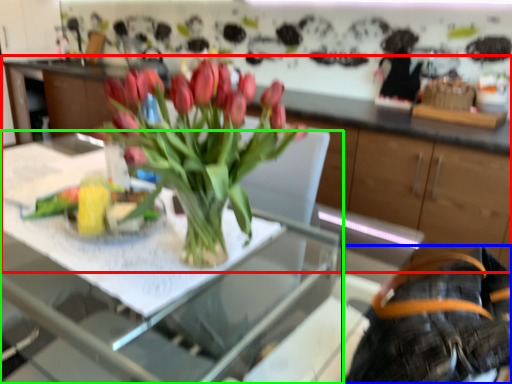
Question: Which object is positioned closest to cabinetry (highlighted by a red box)? Select from back (highlighted by a blue box) and table (highlighted by a green box).

Choices:
 (A) back
 (B) table

Answer: (B)